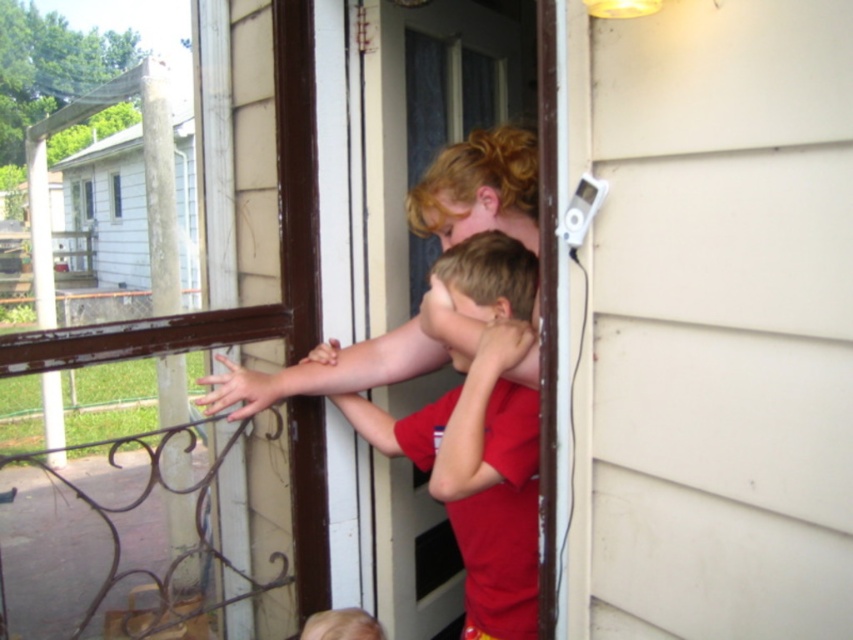
You are a delivery person trying to enter the house through the screen doors. You need to choose the correct door to pass through. Which door should you go through, the white plastic screen door at upper right or the transparent plastic screen door at center?

You should go through the transparent plastic screen door at center because the white plastic screen door at upper right has a smaller size compared to transparent plastic screen door at center, making the transparent one larger and more suitable for a person to pass through.

Based on the photo, you are trying to determine which screen door is easier to see through. Based on the image, which one is thinner between the white plastic screen door at upper right and the transparent plastic screen door at center?

The white plastic screen door at upper right is thinner than the transparent plastic screen door at center, so it might be easier to see through the thinner one.

You are a delivery person trying to enter the house through the screen door. You see the white plastic screen door at upper right and the transparent plastic screen door at center. Which door should you go through to enter the house?

The transparent plastic screen door at center is the correct entrance because the white plastic screen door at upper right is positioned under it, likely indicating it is a window or part of the door frame rather than the main entry point.